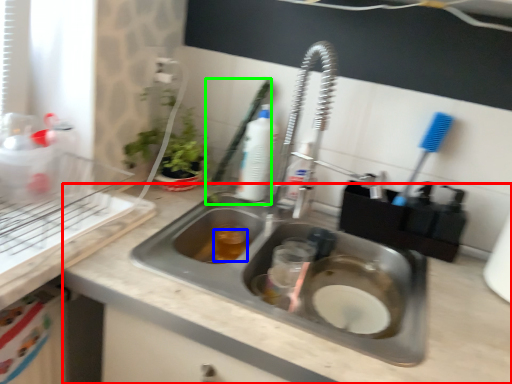
Question: Which object is the farthest from counter top (highlighted by a red box)? Choose among these: liquid (highlighted by a blue box) or brush (highlighted by a green box).

Choices:
 (A) liquid
 (B) brush

Answer: (B)